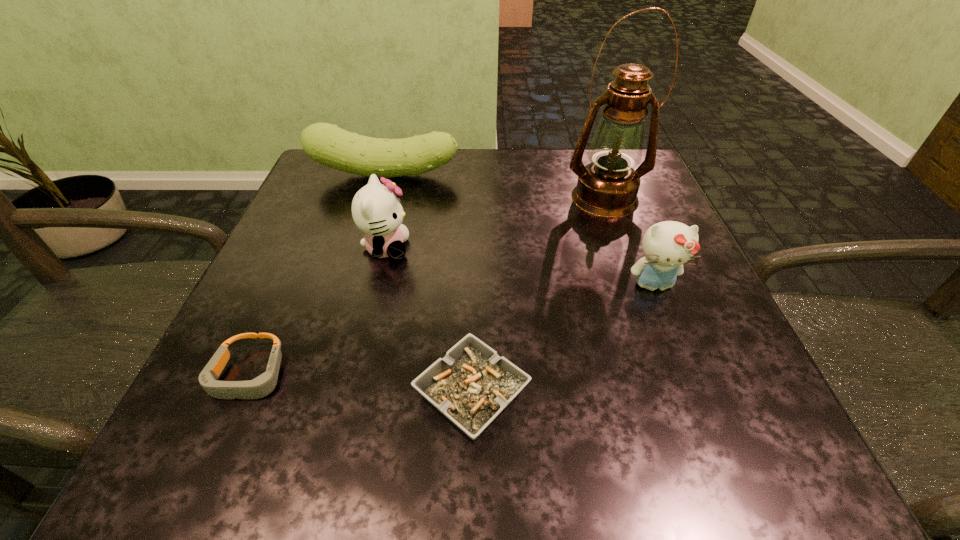
You are a GUI agent. You are given a task and a screenshot of the screen. Output one action in this format:
    pyautogui.click(x=<x>, y=<y>)
    Task: Click on the vacant space located on the front and back of the goggles
    The height and width of the screenshot is (540, 960).
    Given the screenshot: What is the action you would take?
    pyautogui.click(x=206, y=471)

Where is `vacant region located on the back of the ashtray`? The width and height of the screenshot is (960, 540). vacant region located on the back of the ashtray is located at coordinates (473, 286).

Find the location of a particular element. oil lamp at the far edge is located at coordinates [x=607, y=187].

Locate an element on the screen. The image size is (960, 540). cucumber positioned at the far edge is located at coordinates (327, 144).

You are a GUI agent. You are given a task and a screenshot of the screen. Output one action in this format:
    pyautogui.click(x=<x>, y=<y>)
    Task: Click on the goggles that is at the near edge
    Image resolution: width=960 pixels, height=540 pixels.
    Given the screenshot: What is the action you would take?
    pyautogui.click(x=261, y=386)

This screenshot has width=960, height=540. Find the location of `ashtray present at the near edge`. ashtray present at the near edge is located at coordinates (472, 384).

Identify the location of cucumber at the left edge. This screenshot has height=540, width=960. (327, 144).

The height and width of the screenshot is (540, 960). Find the location of `goggles positioned at the left edge`. goggles positioned at the left edge is located at coordinates (261, 386).

Where is `oil lamp that is at the right edge`? The image size is (960, 540). oil lamp that is at the right edge is located at coordinates (607, 187).

Where is `kitten situated at the right edge`? The image size is (960, 540). kitten situated at the right edge is located at coordinates (667, 245).